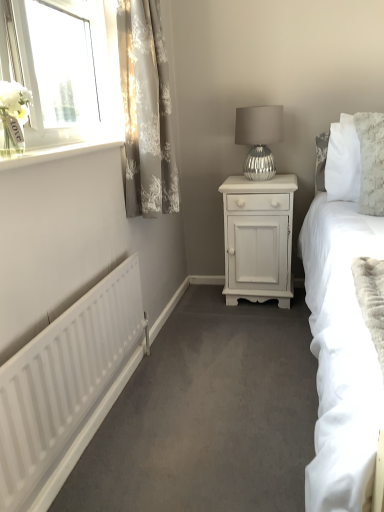
Question: Does gray floral fabric curtain at upper left turn towards white painted wood nightstand at center?

Choices:
 (A) yes
 (B) no

Answer: (B)

Question: From the image's perspective, would you say gray floral fabric curtain at upper left is positioned over white painted wood nightstand at center?

Choices:
 (A) no
 (B) yes

Answer: (B)

Question: Considering the relative sizes of gray floral fabric curtain at upper left and white painted wood nightstand at center in the image provided, is gray floral fabric curtain at upper left taller than white painted wood nightstand at center?

Choices:
 (A) no
 (B) yes

Answer: (B)

Question: Is gray floral fabric curtain at upper left positioned in front of white painted wood nightstand at center?

Choices:
 (A) yes
 (B) no

Answer: (A)

Question: Can you confirm if gray floral fabric curtain at upper left is wider than white painted wood nightstand at center?

Choices:
 (A) yes
 (B) no

Answer: (B)

Question: In terms of width, does gray floral fabric curtain at upper left look wider or thinner when compared to silver textured lamp at center?

Choices:
 (A) wide
 (B) thin

Answer: (B)

Question: Is gray floral fabric curtain at upper left bigger or smaller than silver textured lamp at center?

Choices:
 (A) small
 (B) big

Answer: (B)

Question: Is gray floral fabric curtain at upper left situated inside silver textured lamp at center or outside?

Choices:
 (A) outside
 (B) inside

Answer: (A)

Question: Is gray floral fabric curtain at upper left in front of or behind silver textured lamp at center in the image?

Choices:
 (A) behind
 (B) front

Answer: (B)

Question: Is white matte radiator at lower left to the left or to the right of gray floral fabric curtain at upper left in the image?

Choices:
 (A) left
 (B) right

Answer: (A)

Question: From the image's perspective, is white matte radiator at lower left positioned above or below gray floral fabric curtain at upper left?

Choices:
 (A) below
 (B) above

Answer: (A)

Question: Is white matte radiator at lower left wider or thinner than gray floral fabric curtain at upper left?

Choices:
 (A) wide
 (B) thin

Answer: (B)

Question: Is white matte radiator at lower left inside or outside of gray floral fabric curtain at upper left?

Choices:
 (A) outside
 (B) inside

Answer: (A)

Question: In the image, is gray floral fabric curtain at upper left on the left side or the right side of white painted wood nightstand at center?

Choices:
 (A) left
 (B) right

Answer: (A)

Question: From their relative heights in the image, would you say gray floral fabric curtain at upper left is taller or shorter than white painted wood nightstand at center?

Choices:
 (A) short
 (B) tall

Answer: (B)